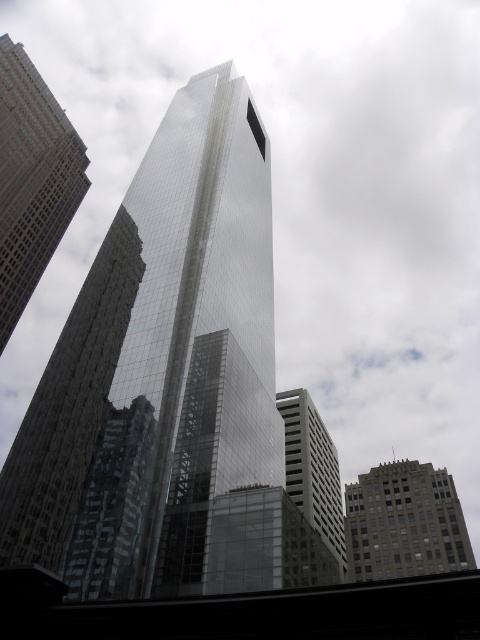
Question: Based on their relative distances, which object is nearer to the glassy reflective skyscraper at left?

Choices:
 (A) reflective glass skyscraper at center
 (B) gray concrete building at lower right

Answer: (A)

Question: Does glassy reflective skyscraper at left come behind white glass building at center?

Choices:
 (A) no
 (B) yes

Answer: (B)

Question: Considering the real-world distances, which object is closest to the reflective glass skyscraper at center?

Choices:
 (A) gray concrete building at lower right
 (B) glassy reflective skyscraper at left
 (C) white glass building at center

Answer: (C)

Question: Where is glassy reflective skyscraper at left located in relation to white glass building at center in the image?

Choices:
 (A) right
 (B) left

Answer: (B)

Question: Which point appears closest to the camera in this image?

Choices:
 (A) (x=410, y=474)
 (B) (x=39, y=236)
 (C) (x=299, y=435)

Answer: (C)

Question: Where is glassy reflective skyscraper at left located in relation to white glass building at center in the image?

Choices:
 (A) above
 (B) below

Answer: (A)